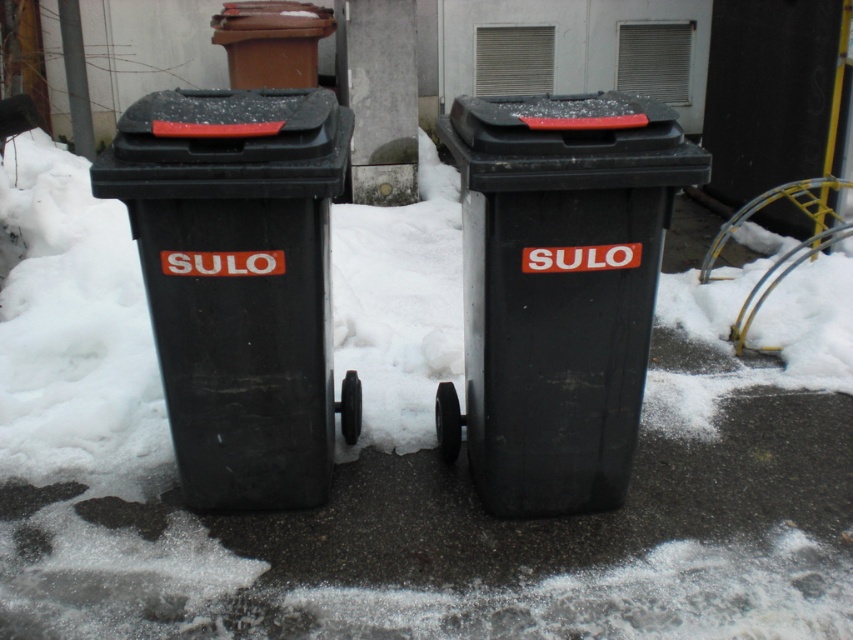
Question: Can you confirm if black plastic recycling bin at center is positioned to the right of black plastic recycling bin at left?

Choices:
 (A) no
 (B) yes

Answer: (B)

Question: Can you confirm if black plastic recycling bin at center is positioned to the right of black plastic recycling bin at left?

Choices:
 (A) no
 (B) yes

Answer: (B)

Question: Which point is farther to the camera?

Choices:
 (A) 614,314
 (B) 274,445

Answer: (B)

Question: Which object is farther from the camera taking this photo?

Choices:
 (A) black plastic recycling bin at left
 (B) black plastic recycling bin at center

Answer: (B)

Question: Is black plastic recycling bin at center thinner than black plastic recycling bin at left?

Choices:
 (A) yes
 (B) no

Answer: (B)